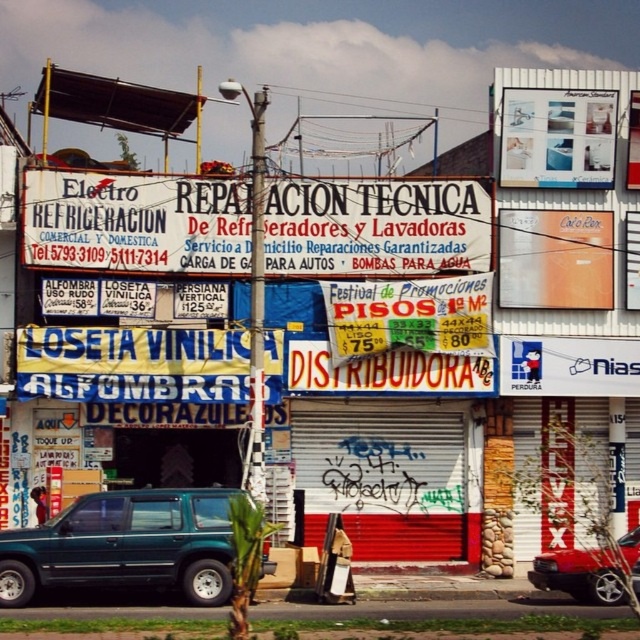
You are a tourist in this area and need to read the white paper sign at center. There is a green matte suv at lower left parked nearby. Will the suv block your view of the sign?

The white paper sign at center has a lesser height compared to the green matte suv at lower left. Since the sign is shorter than the SUV, the SUV might block your view of the sign depending on your position.

You are standing on the street looking at the Electro Reparacion Tecnica sign. There are two points marked in the image. Which point is closer to you, point at (104, 236) or point at (156, 576)?

Point at (104, 236) is closer to you than point at (156, 576).

You are standing in the middle of the street looking at the Electro Reparacion Tecnica sign. There are two points marked on the image, one at coordinates point (176, 188) and the other at point (609, 577). Which point is closer to you?

The point at (176, 188) is closer to you because it is further to the camera than point (609, 577).